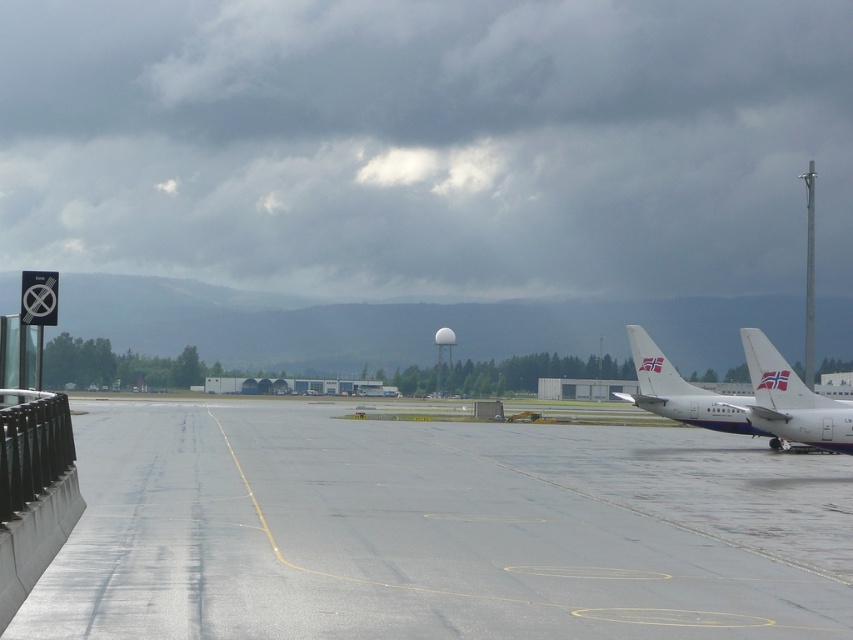
Question: Which object appears farthest from the camera in this image?

Choices:
 (A) white matte airplane at right
 (B) smooth asphalt runway at center

Answer: (A)

Question: Is smooth asphalt runway at center below white matte airplane at right?

Choices:
 (A) no
 (B) yes

Answer: (B)

Question: Which object appears farthest from the camera in this image?

Choices:
 (A) white matte airplane at right
 (B) smooth asphalt runway at center

Answer: (A)

Question: Observing the image, what is the correct spatial positioning of smooth asphalt runway at center in reference to white matte airplane at right?

Choices:
 (A) left
 (B) right

Answer: (A)

Question: Is smooth asphalt runway at center in front of white matte airplane at right?

Choices:
 (A) no
 (B) yes

Answer: (B)